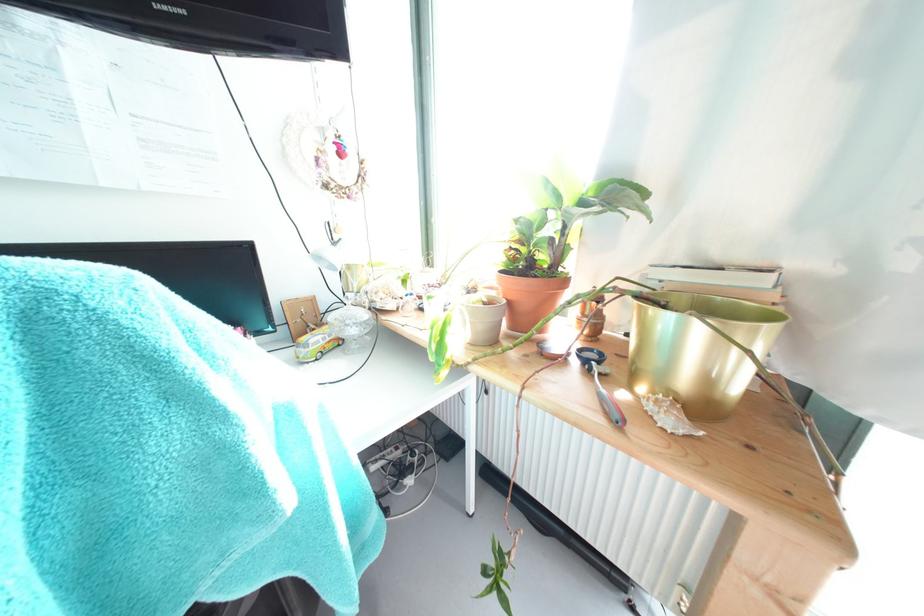
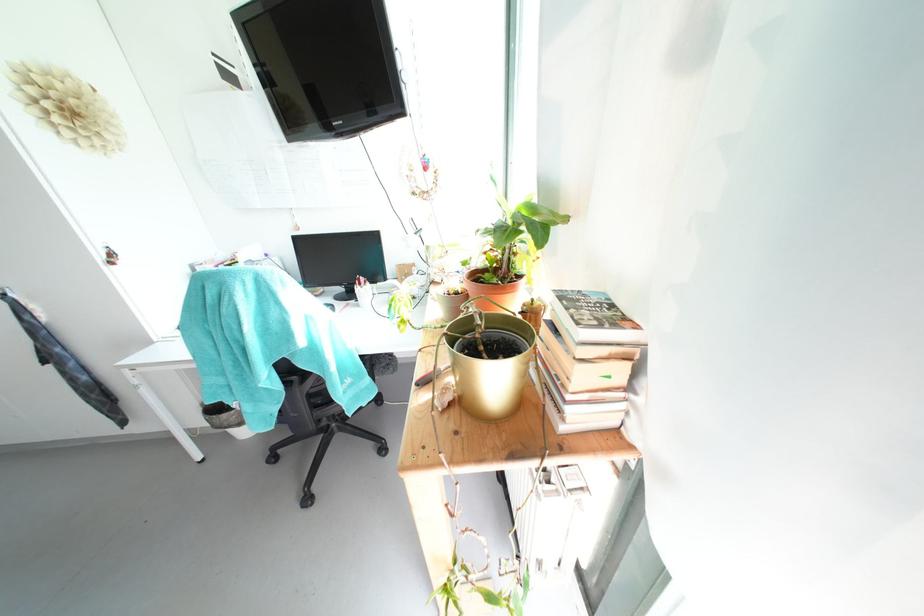
Question: How did the camera likely rotate?

Choices:
 (A) Left
 (B) Right
 (C) Up
 (D) Down

Answer: (A)